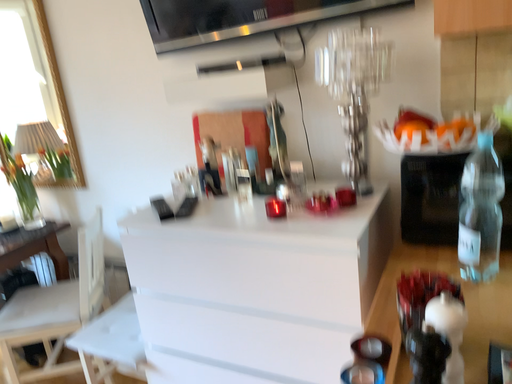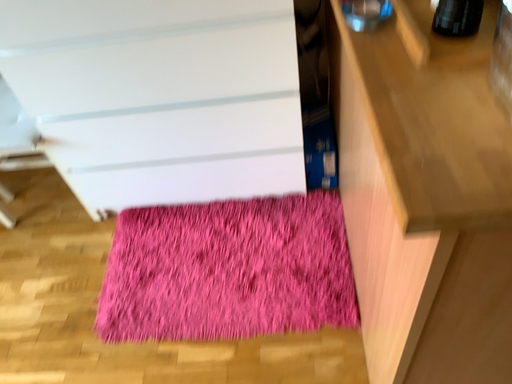
Question: How did the camera likely rotate when shooting the video?

Choices:
 (A) rotated downward
 (B) rotated upward

Answer: (A)